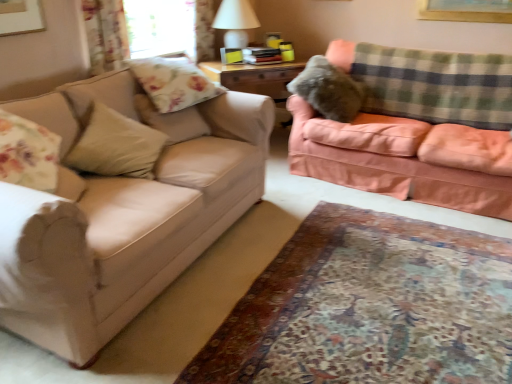
Find the location of `free spot below carpet at lower center (from a real-world perspective)`. free spot below carpet at lower center (from a real-world perspective) is located at coordinates (402, 311).